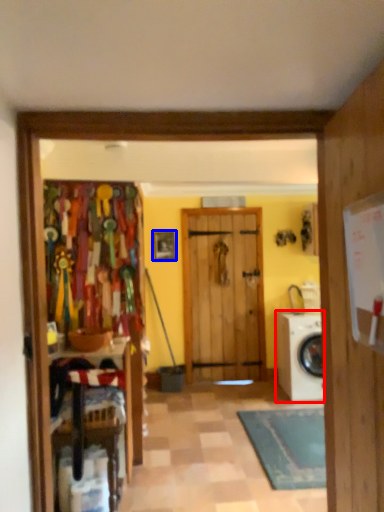
Question: Which object is further to the camera taking this photo, washing machine (highlighted by a red box) or picture frame (highlighted by a blue box)?

Choices:
 (A) washing machine
 (B) picture frame

Answer: (B)